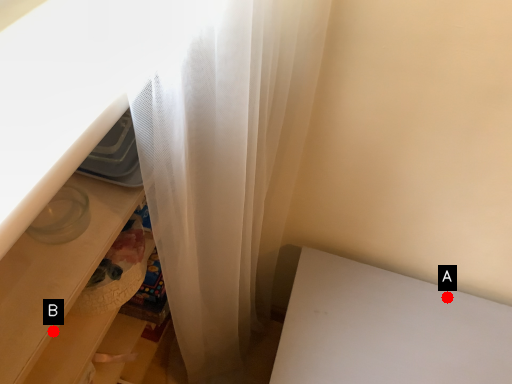
Question: Two points are circled on the image, labeled by A and B beside each circle. Among these points, which one is farthest from the camera?

Choices:
 (A) A is further
 (B) B is further

Answer: (A)